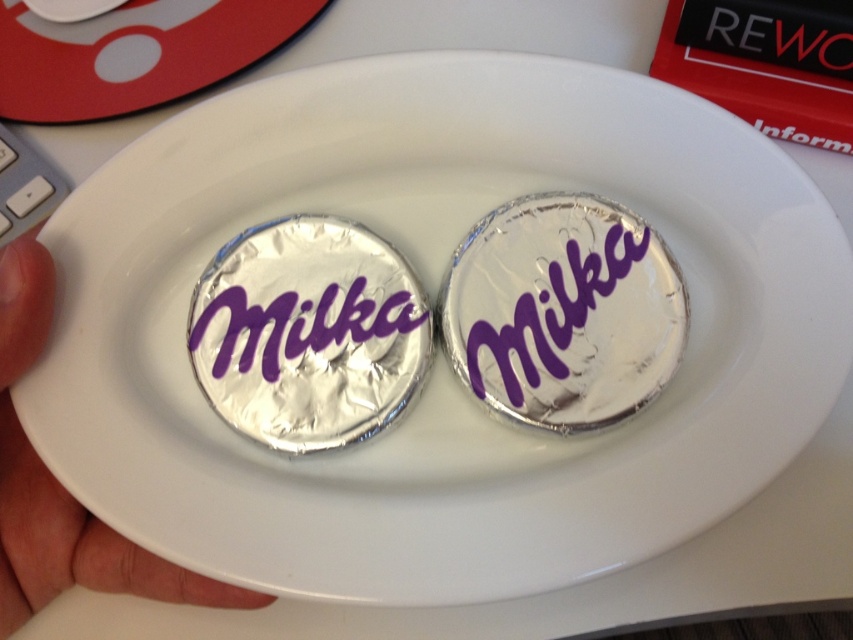
You are trying to place the red matte mouse pad at upper left on the table next to the skinny white hand at center. Based on their sizes, will the mouse pad fit under the hand without overlapping?

The red matte mouse pad at upper left is not as tall as the skinny white hand at center, so it can fit under the hand without overlapping since it is shorter in height.

Looking at this image, you are a photographer adjusting your camera focus. You notice two points in the image labeled as point [160,64] and point [53,531]. Which point should you focus on first if you want to ensure the closer object is sharp?

You should focus on point [160,64] first because it is closer to the camera than point [53,531] according to their positions in the image.